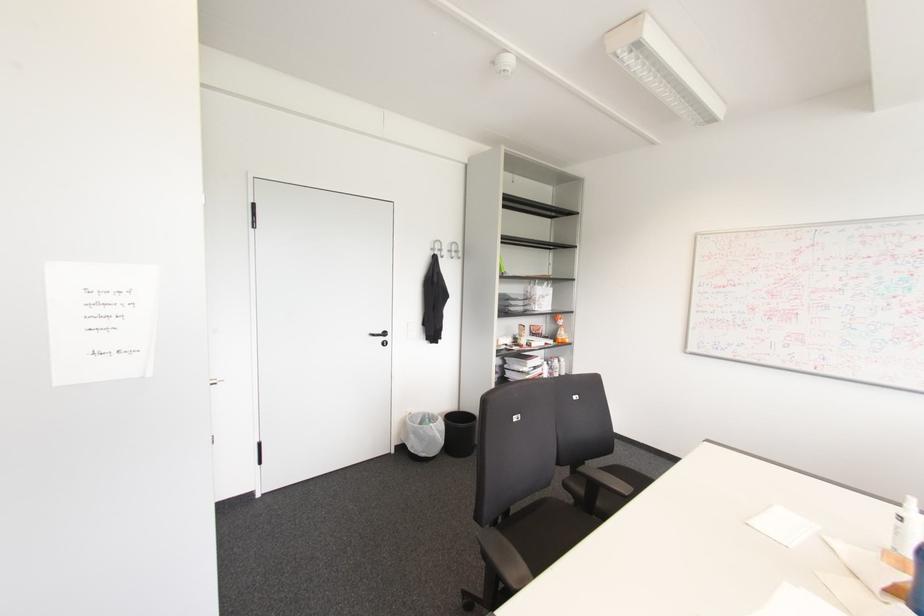
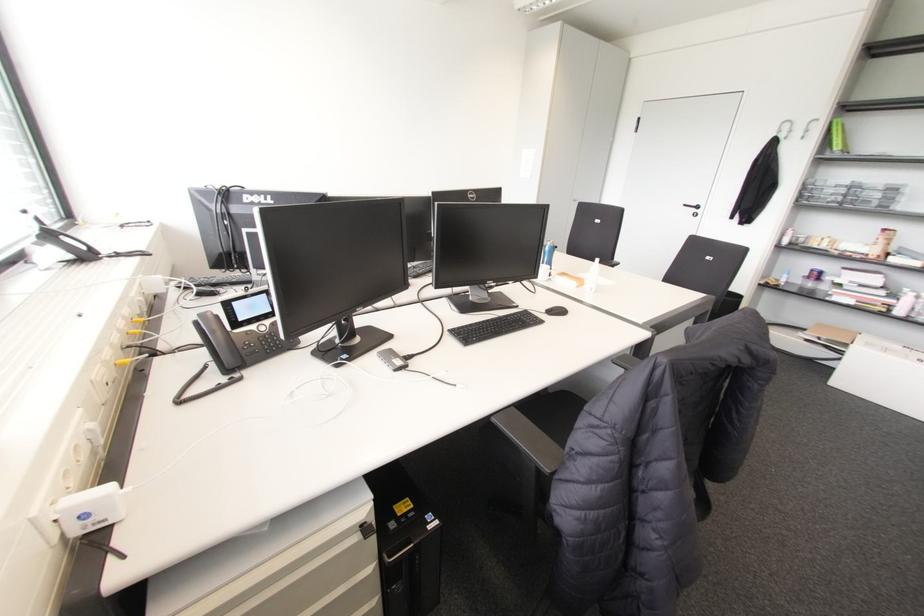
Where in the second image is the point corresponding to the point at 383,333 from the first image?

(697, 207)